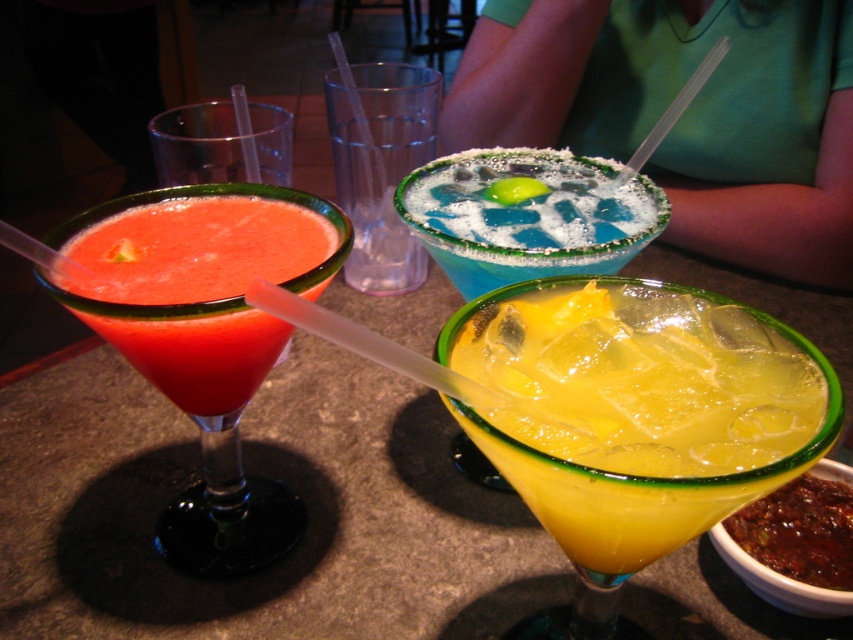
Question: Estimate the real-world distances between objects in this image. Which object is farther from the blue salted rimmed glass at center?

Choices:
 (A) transparent plastic cup at upper left
 (B) translucent plastic cup at center
 (C) matte glassy margarita at left

Answer: (A)

Question: Estimate the real-world distances between objects in this image. Which object is closer to the yellow translucent liquid at center?

Choices:
 (A) blue salted rimmed glass at center
 (B) matte glassy margarita at left
 (C) translucent blue margarita at center

Answer: (A)

Question: Is matte glassy margarita at left positioned behind translucent plastic cup at center?

Choices:
 (A) no
 (B) yes

Answer: (A)

Question: Among these objects, which one is farthest from the camera?

Choices:
 (A) blue salted margarita at center
 (B) translucent plastic cup at center
 (C) translucent blue margarita at center

Answer: (A)

Question: Does yellow translucent liquid at center have a lesser width compared to translucent blue margarita at center?

Choices:
 (A) no
 (B) yes

Answer: (B)

Question: Does translucent blue margarita at center have a larger size compared to translucent plastic cup at center?

Choices:
 (A) no
 (B) yes

Answer: (A)